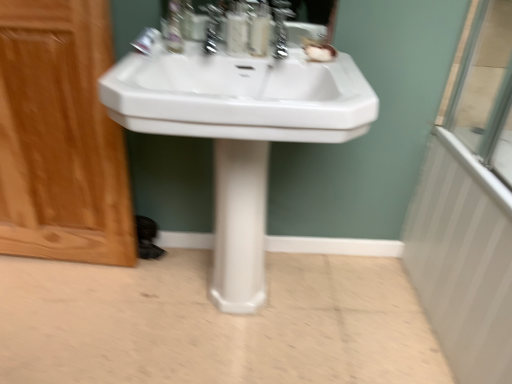
Locate an element on the screen. The image size is (512, 384). vacant space in front of wooden screen door at left is located at coordinates (53, 314).